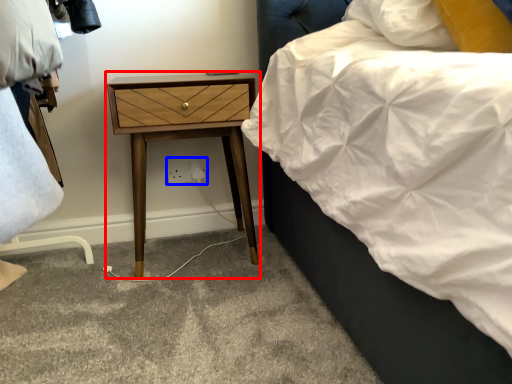
Question: Which point is closer to the camera, nightstand (highlighted by a red box) or electric outlet (highlighted by a blue box)?

Choices:
 (A) nightstand
 (B) electric outlet

Answer: (A)